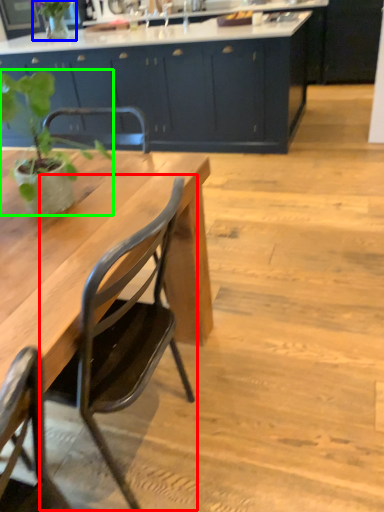
Question: Which is nearer to the chair (highlighted by a red box)? plant (highlighted by a blue box) or houseplant (highlighted by a green box).

Choices:
 (A) plant
 (B) houseplant

Answer: (B)